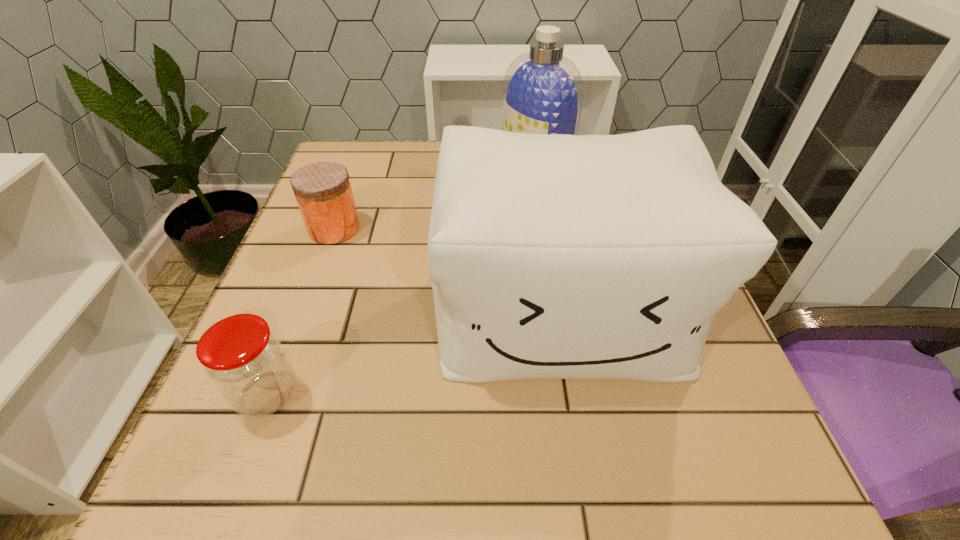
This screenshot has width=960, height=540. I want to click on cushion present at the right edge, so click(x=559, y=256).

This screenshot has width=960, height=540. In order to click on object that is at the far right corner in this screenshot , I will do `click(543, 92)`.

Find the location of a particular element. vacant space at the near edge is located at coordinates (534, 461).

In the image, there is a desktop. Where is `free region at the left edge`? The width and height of the screenshot is (960, 540). free region at the left edge is located at coordinates (319, 284).

Identify the location of free region at the right edge of the desktop. (701, 440).

This screenshot has width=960, height=540. In the image, there is a desktop. In order to click on free region at the far left corner in this screenshot , I will do `click(388, 153)`.

Where is `vacant space at the near left corner`? The width and height of the screenshot is (960, 540). vacant space at the near left corner is located at coordinates (258, 477).

I want to click on free space at the near right corner of the desktop, so click(x=684, y=457).

Image resolution: width=960 pixels, height=540 pixels. Find the location of `vacant area between the third nearest object and the nearer jar`. vacant area between the third nearest object and the nearer jar is located at coordinates (300, 312).

Identify the location of unoccupied area between the farthest object and the nearer jar. The width and height of the screenshot is (960, 540). (401, 280).